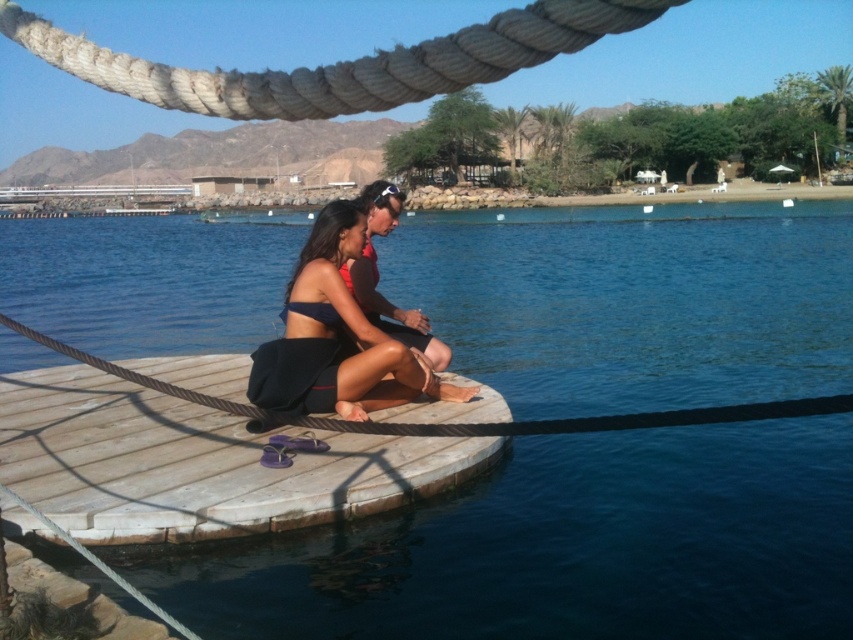
Looking at this image, you are a park ranger checking the safety of the wooden dock at center and the matte black bikini top at center. The safety regulation states that the minimum distance between any two structures must be at least 4 feet. Is the current distance compliant with the regulation?

The distance between the wooden dock at center and the matte black bikini top at center is 3.66 feet, which is less than the required 4 feet. Therefore, it does not comply with the safety regulation.